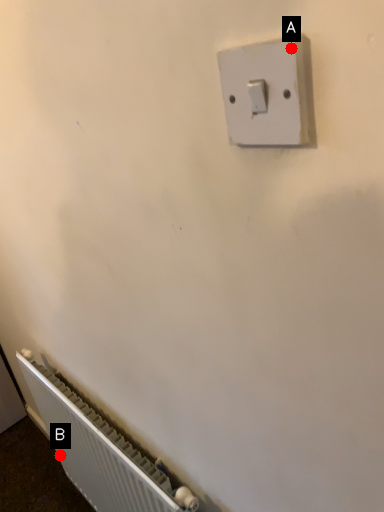
Question: Two points are circled on the image, labeled by A and B beside each circle. Which point is farther from the camera taking this photo?

Choices:
 (A) A is further
 (B) B is further

Answer: (B)